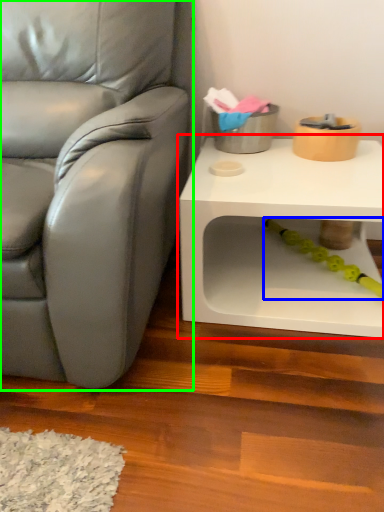
Question: Considering the real-world distances, which object is closest to table (highlighted by a red box)? toy (highlighted by a blue box) or chair (highlighted by a green box).

Choices:
 (A) toy
 (B) chair

Answer: (A)